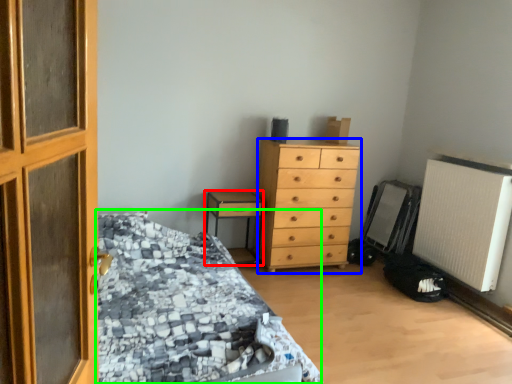
Question: Which object is the closest to the nightstand (highlighted by a red box)? Choose among these: chest of drawers (highlighted by a blue box) or bed (highlighted by a green box).

Choices:
 (A) chest of drawers
 (B) bed

Answer: (A)